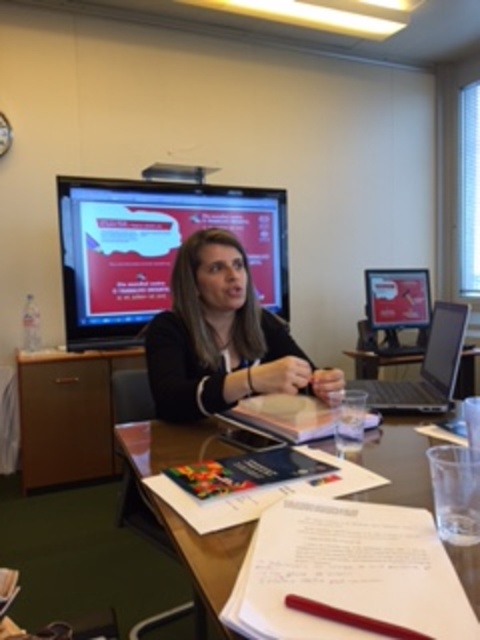
You are a participant in the meeting and need to place a small object on the table without disturbing the presenter. Where should you place it based on the white paper at center?

You should place the small object near the white paper at center, which is located at coordinates point (x=179, y=515).

You are setting up for a presentation and need to place a projector screen that will occupy the space where the matte black monitor at upper center is currently located. Can you move the monitor to the right side of the table without overlapping any existing items?

The matte black monitor at upper center is located at point (155, 248). However, without specific spatial relationships between the monitor and other items on the table, it is impossible to determine if moving it to the right side would cause overlap. Check the exact positions of other objects before deciding.

You are organizing the items on the table for a presentation. You need to place the white paper at center to the right of the matte black monitor at upper center. Is the current arrangement already meeting this requirement?

The matte black monitor at upper center is positioned on the left side of white paper at center, so yes, the current arrangement already meets the requirement of placing the white paper at center to the right of the matte black monitor at upper center.